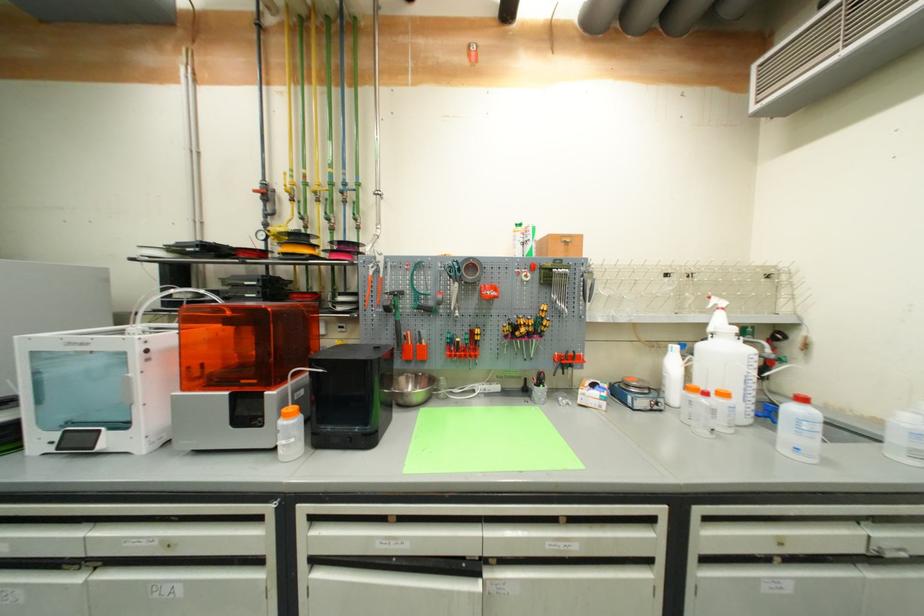
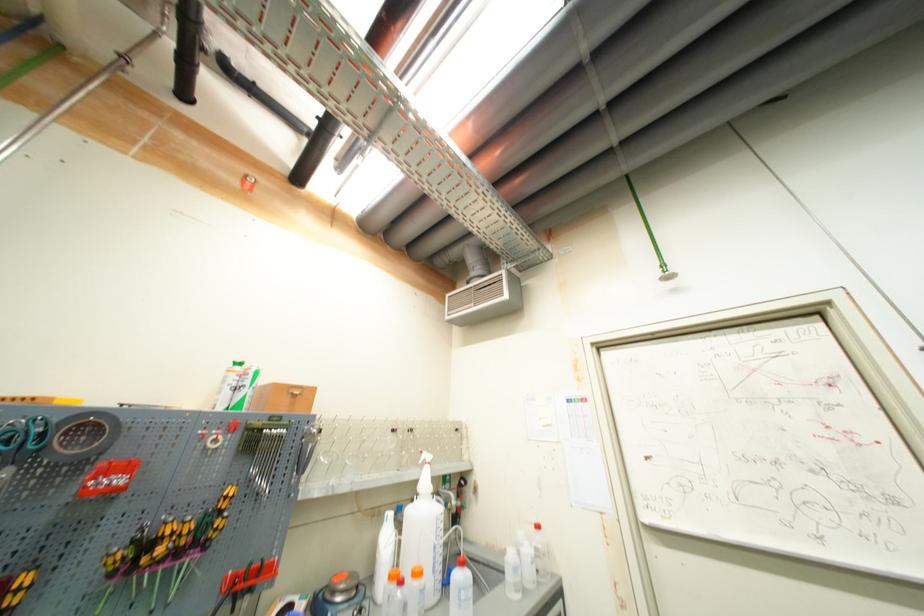
Locate, in the second image, the point that corresponds to the point at 473,278 in the first image.

(67, 453)